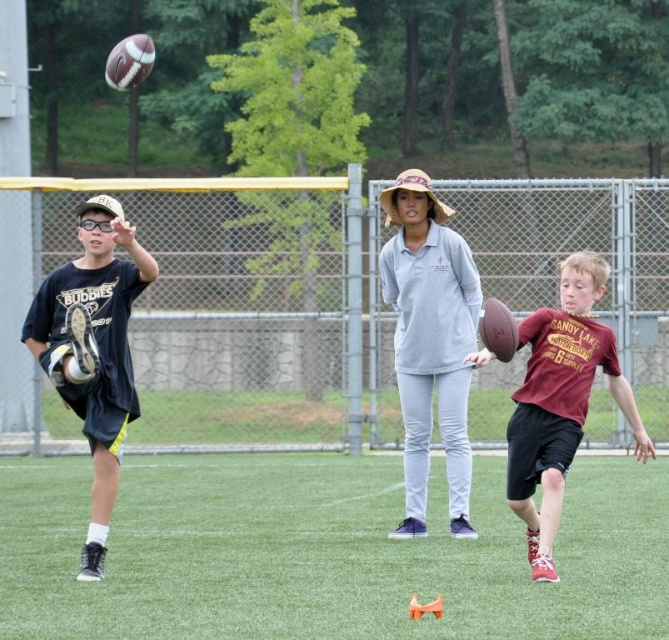
You are standing at the point labeled as point (189, 572) and want to take a photo of the football field. The camera you have can capture objects up to 10 meters away. Will the camera be able to capture the entire football field in your photo?

The distance between point (189, 572) and the camera is 9.88 meters, which is within the camera range of 10 meters. Therefore, the camera can capture the entire football field from that position.